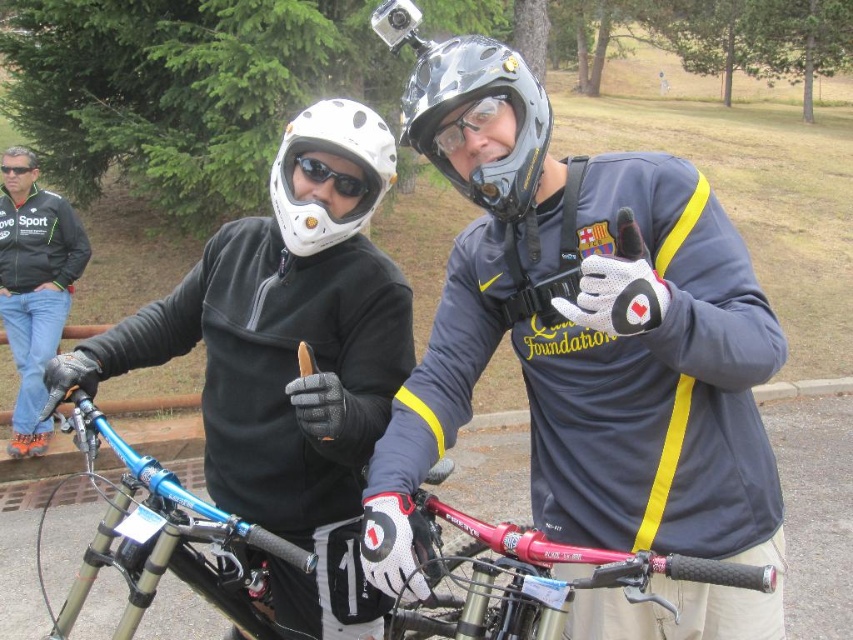
You are a photographer trying to capture the perfect shot of the matte black helmet at upper left and the black leather jacket at upper left. Based on their positions, which object should you focus on first to ensure both are in frame?

The matte black helmet at upper left is below the black leather jacket at upper left, so you should focus on the black leather jacket at upper left first to ensure both are in frame.

You are a photographer trying to capture a photo of both the shiny blue frame at center and the black matte goggles at upper left in the scene. Since you want both objects to be clearly visible in the frame, which object should you focus on first to ensure proper alignment?

The black matte goggles at upper left should be focused on first because the shiny blue frame at center is positioned to its right, so adjusting focus starting from the left ensures both are in the frame.

You are a photographer who wants to take a photo of the shiny blue frame at center. You have a camera that requires a minimum distance of 1 meter to focus properly. Can you position yourself at the camera location to take a clear photo?

The shiny blue frame at center and camera are 1.25 meters apart, which is more than the minimum 1 meter required for the camera to focus. Therefore, you can position yourself at the camera location to take a clear photo.